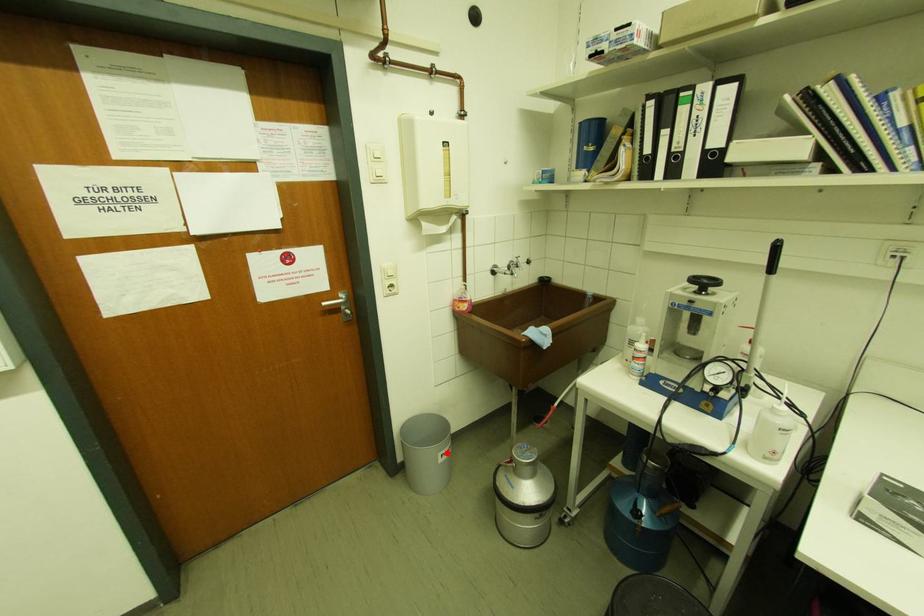
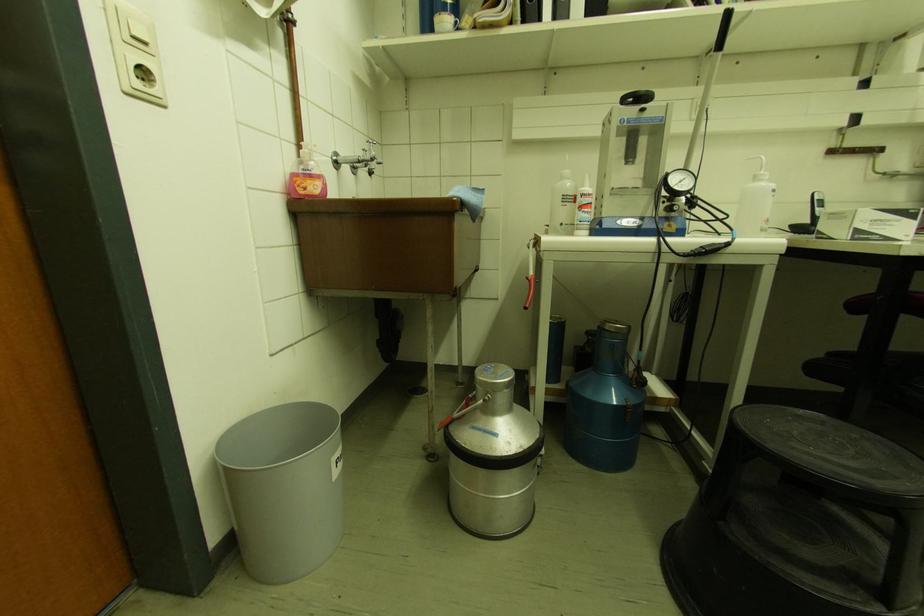
In the second image, find the point that corresponds to the highlighted location in the first image.

(341, 455)